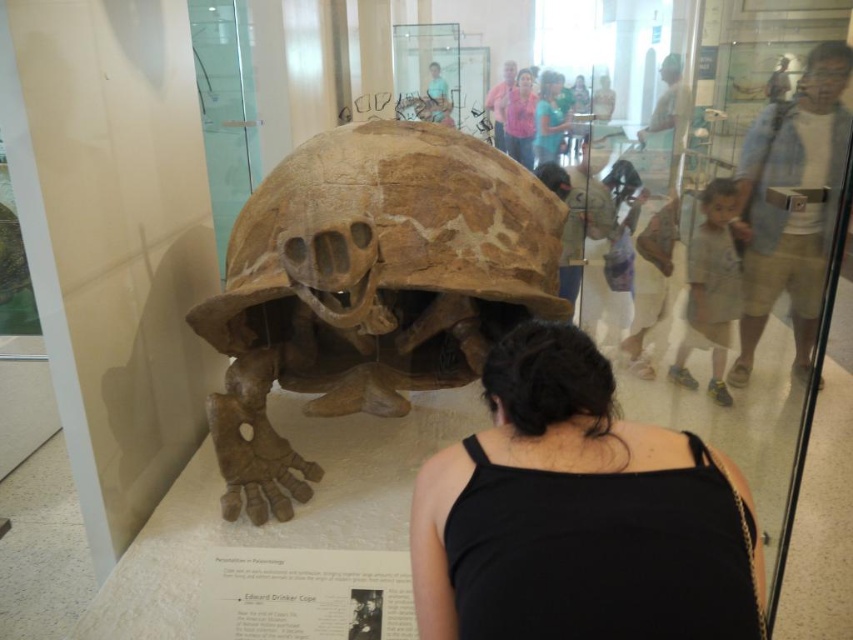
Question: Can you confirm if brown bone-like at center is positioned below pink fabric shirt at upper center?

Choices:
 (A) no
 (B) yes

Answer: (B)

Question: Which point appears farthest from the camera in this image?

Choices:
 (A) (659, 621)
 (B) (506, 144)
 (C) (463, 294)

Answer: (B)

Question: Is black fabric at center bigger than pink fabric shirt at upper center?

Choices:
 (A) no
 (B) yes

Answer: (B)

Question: Which of the following is the farthest from the observer?

Choices:
 (A) pyautogui.click(x=460, y=166)
 (B) pyautogui.click(x=526, y=92)
 (C) pyautogui.click(x=692, y=602)

Answer: (B)

Question: Which of the following is the closest to the observer?

Choices:
 (A) black fabric at center
 (B) brown bone-like at center

Answer: (A)

Question: Can you confirm if black fabric at center is positioned above pink fabric shirt at upper center?

Choices:
 (A) no
 (B) yes

Answer: (A)